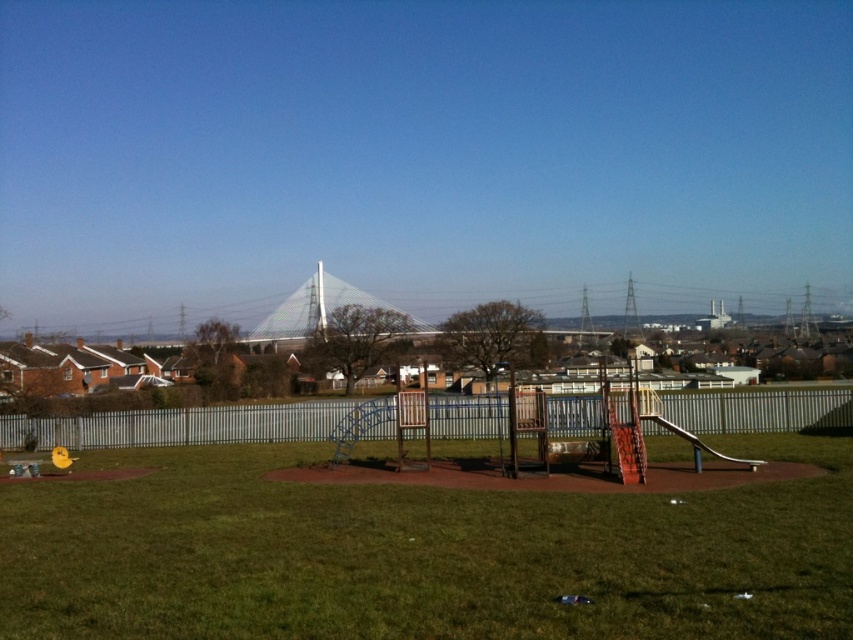
In the scene shown: Who is lower down, green grass at center or metallic silver fence at center?

metallic silver fence at center is below.

Can you confirm if green grass at center is thinner than metallic silver fence at center?

Yes.

The image size is (853, 640). What do you see at coordinates (421, 554) in the screenshot?
I see `green grass at center` at bounding box center [421, 554].

Identify the location of green grass at center. The width and height of the screenshot is (853, 640). (421, 554).